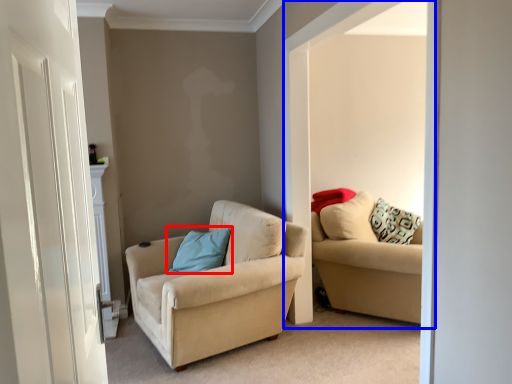
Question: Which object is further to the camera taking this photo, pillow (highlighted by a red box) or window (highlighted by a blue box)?

Choices:
 (A) pillow
 (B) window

Answer: (A)